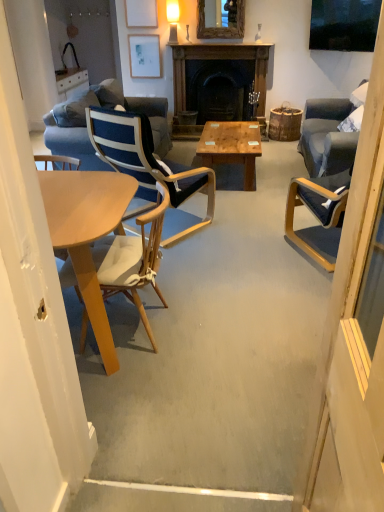
The height and width of the screenshot is (512, 384). What are the coordinates of `vacant space to the right of blue fabric chair at center, placed as the 2th chair when sorted from front to back` in the screenshot? It's located at (244, 226).